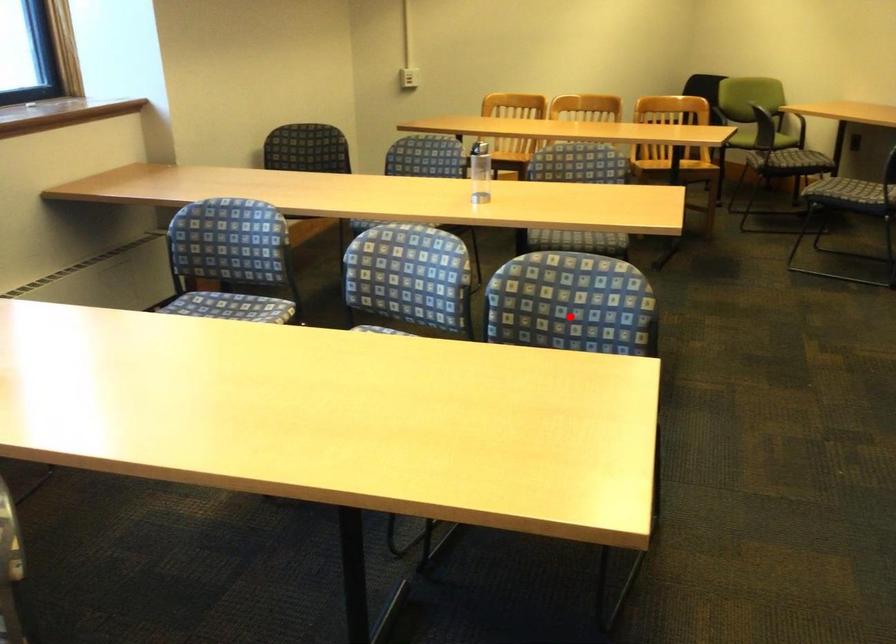
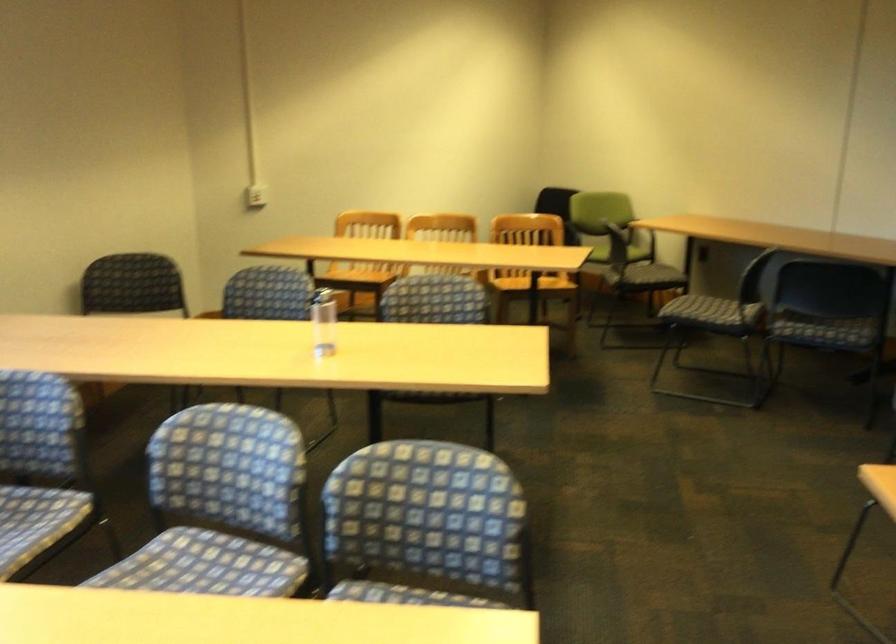
The point at the highlighted location is marked in the first image. Where is the corresponding point in the second image?

(425, 527)